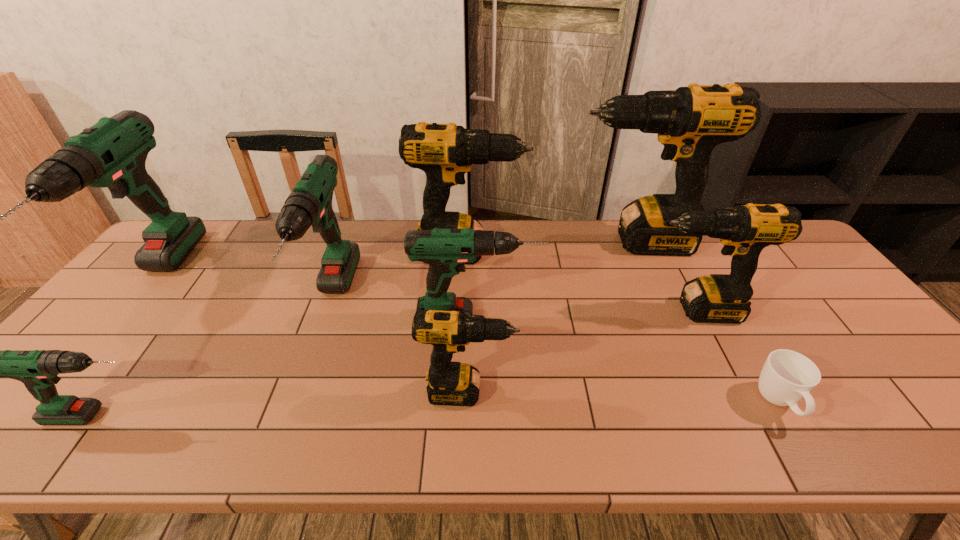
Identify which drill is the sixth nearest to the rightmost green drill. Please provide its 2D coordinates. Your answer should be formatted as a tuple, i.e. [(x, y)], where the tuple contains the x and y coordinates of a point satisfying the conditions above.

[(37, 369)]

Locate which drill is the fifth closest to the shortest object. Please provide its 2D coordinates. Your answer should be formatted as a tuple, i.e. [(x, y)], where the tuple contains the x and y coordinates of a point satisfying the conditions above.

[(445, 152)]

The width and height of the screenshot is (960, 540). I want to click on the third closest black drill to the third object from left to right, so click(x=691, y=121).

You are a GUI agent. You are given a task and a screenshot of the screen. Output one action in this format:
    pyautogui.click(x=<x>, y=<y>)
    Task: Click on the closest black drill to the nearest green drill
    
    Given the screenshot: What is the action you would take?
    pyautogui.click(x=450, y=383)

Identify which green drill is the second nearest to the sixth drill from right to left. Please provide its 2D coordinates. Your answer should be formatted as a tuple, i.e. [(x, y)], where the tuple contains the x and y coordinates of a point satisfying the conditions above.

[(37, 369)]

Point out which green drill is positioned as the nearest to the shortest drill. Please provide its 2D coordinates. Your answer should be formatted as a tuple, i.e. [(x, y)], where the tuple contains the x and y coordinates of a point satisfying the conditions above.

[(112, 153)]

Locate an element on the screen. This screenshot has height=540, width=960. vacant point that satisfies the following two spatial constraints: 1. at the tip of the third smallest black drill; 2. on the handle side of the sixth drill from right to left is located at coordinates (467, 301).

The width and height of the screenshot is (960, 540). What are the coordinates of `vacant space that satisfies the following two spatial constraints: 1. with the handle on the side of the cup; 2. on the handle side of the shortest drill` in the screenshot? It's located at (786, 416).